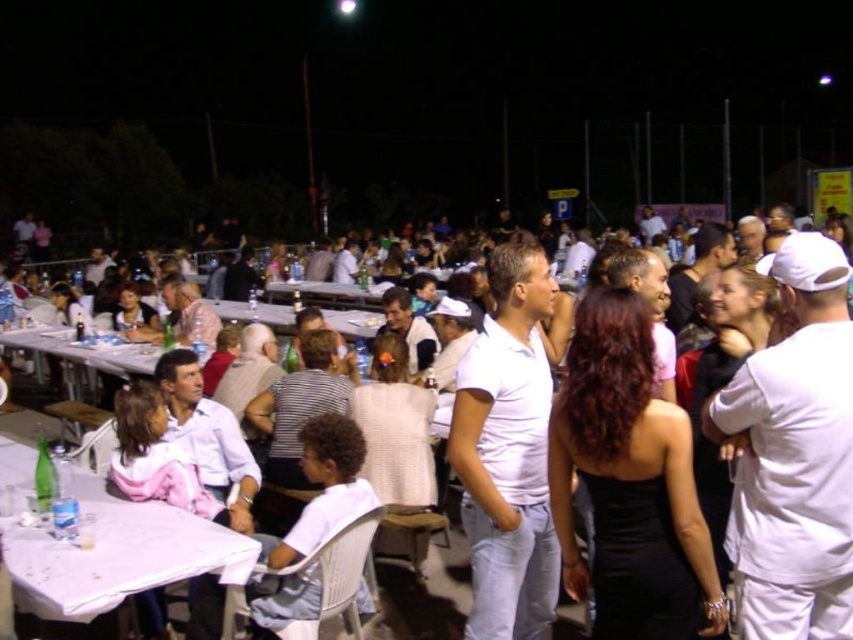
You are a photographer holding a camera at the center of the image. You want to take a photo of the white plastic table at lower left without any people blocking the view. Can you move closer to the table to ensure it fills the frame? The maximum distance you can move forward is 8 feet.

The white plastic table at lower left and camera are 8.41 feet apart. Since you can only move forward 8 feet, you cannot close the remaining 0.41 feet to reach the table. Therefore, you cannot move close enough to fill the frame without people blocking the view.

You are standing at the center of the image and want to walk towards the point marked as point (117,554). Which direction should you go?

The point (117,554) is located on the white plastic table at lower left, so you should walk towards the lower left direction to reach it.

You are at the point labeled point (724, 512) and want to move to the point labeled point (80, 356). Which direction should you move to get closer to your destination?

You should move downward and to the left to get closer to point (80, 356) since it is located below and to the left of point (724, 512).